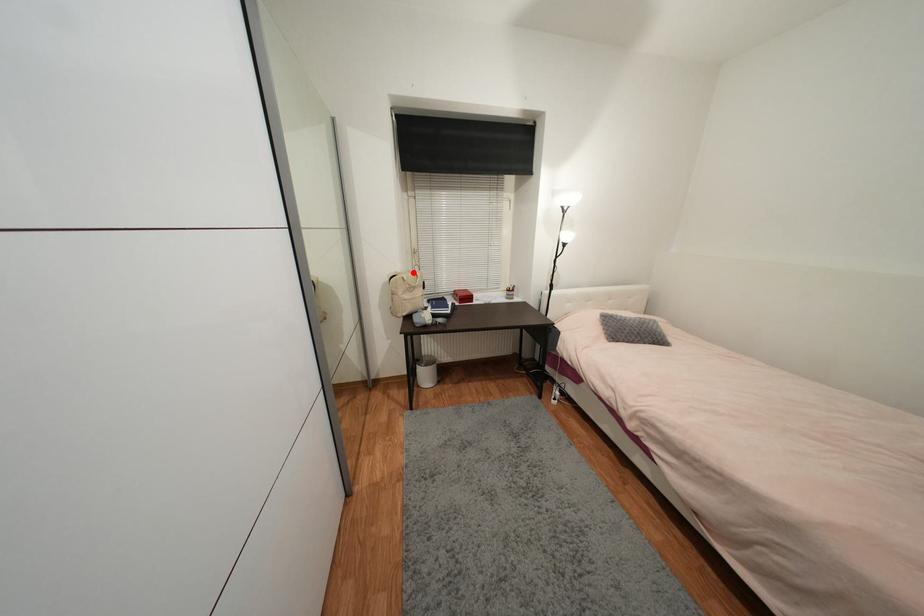
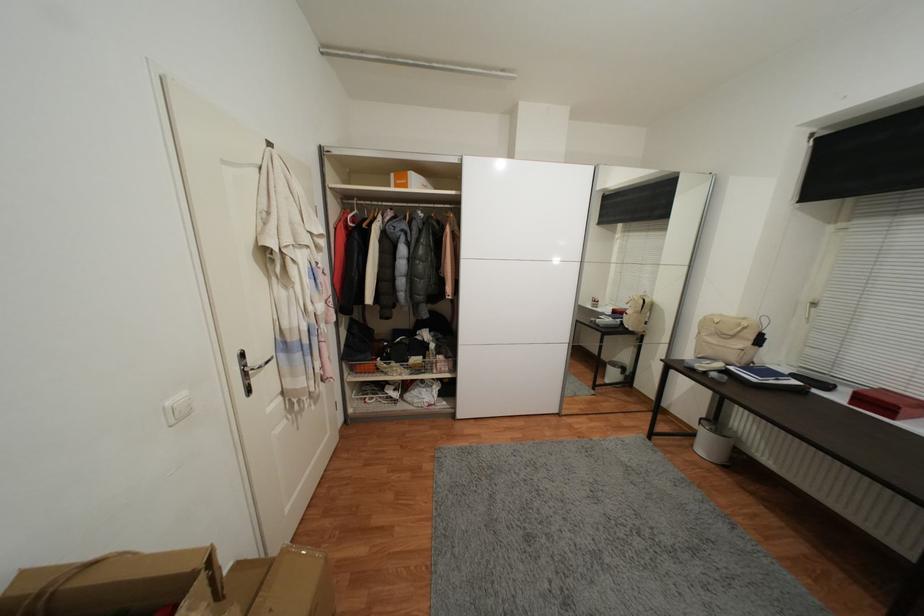
Find the pixel in the second image that matches the highlighted location in the first image.

(748, 321)